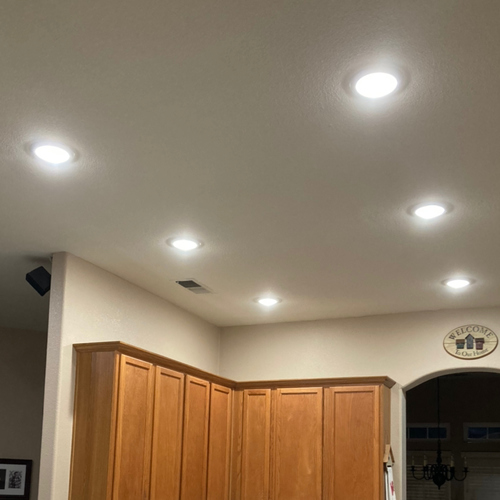
Identify the location of ceiling. (235, 150).